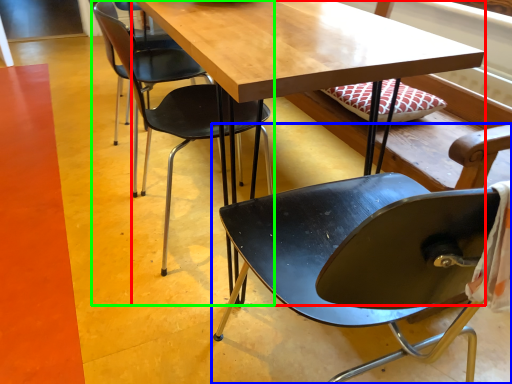
Question: Considering the real-world distances, which object is farthest from table (highlighted by a red box)? chair (highlighted by a blue box) or chair (highlighted by a green box)?

Choices:
 (A) chair
 (B) chair

Answer: (A)